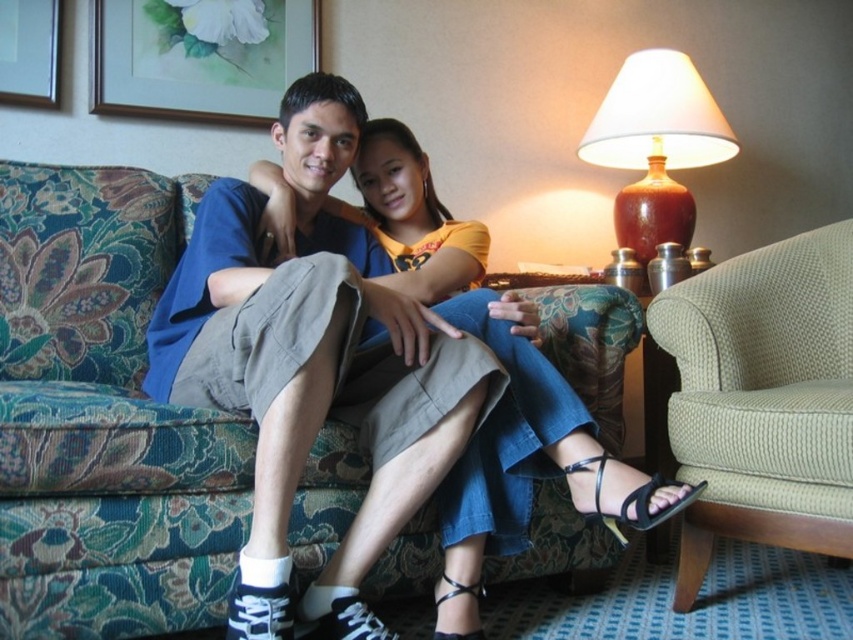
You are a guest in this living room and want to sit in the green fabric armchair at right without moving the brown ceramic lamp at upper right. Is this possible?

The green fabric armchair at right is positioned on the left side of brown ceramic lamp at upper right, so you can sit in the green fabric armchair at right without moving the brown ceramic lamp at upper right since they are placed side by side.

You are designing a living room layout and want to place a new sofa that is the same size as the floral fabric couch at center. Based on the scene, which object can you use as a reference to ensure the new sofa will fit in the space where the matte floral painting at upper left is currently located?

The floral fabric couch at center is larger than the matte floral painting at upper left. Therefore, the new sofa, which is the same size as the floral fabric couch at center, would not fit in the space where the matte floral painting at upper left is located because it is bigger.

You are a photographer standing at the camera position. You want to take a photo of the two people on the couch. However, you notice that the green fabric armchair at right is blocking your view. Can you move the armchair to the side so that it is at least 5 feet away from the camera to get a clear shot?

The green fabric armchair at right is currently 4.09 feet away from the camera. Since 4.09 feet is less than 5 feet, moving it to at least 5 feet away would allow for a clear shot without obstruction.